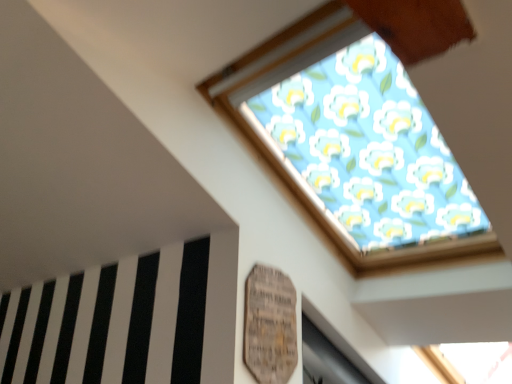
What do you see at coordinates (270, 325) in the screenshot?
I see `rusty metal plaque at center` at bounding box center [270, 325].

You are a GUI agent. You are given a task and a screenshot of the screen. Output one action in this format:
    pyautogui.click(x=<x>, y=<y>)
    Task: Click on the rusty metal plaque at center
    
    Given the screenshot: What is the action you would take?
    pyautogui.click(x=270, y=325)

This screenshot has width=512, height=384. What are the coordinates of `rusty metal plaque at center` in the screenshot? It's located at (270, 325).